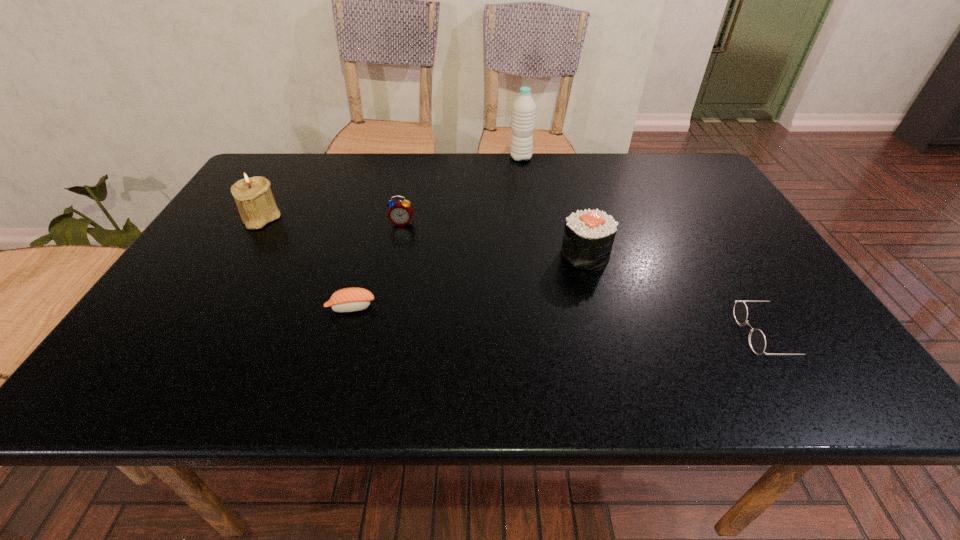
The width and height of the screenshot is (960, 540). What are the coordinates of `the fourth object from left to right` in the screenshot? It's located at (524, 108).

I want to click on the farthest object, so click(x=524, y=108).

The image size is (960, 540). In order to click on the leftmost object in this screenshot , I will do `click(253, 196)`.

Identify the location of the second tallest object. Image resolution: width=960 pixels, height=540 pixels. (253, 196).

Find the location of a particular element. the right sushi is located at coordinates (588, 238).

Locate an element on the screen. the farther sushi is located at coordinates [588, 238].

Find the location of a particular element. This screenshot has height=540, width=960. the fourth tallest object is located at coordinates 400,212.

The width and height of the screenshot is (960, 540). I want to click on spectacles, so click(757, 341).

Where is `the left sushi`? the left sushi is located at coordinates (353, 299).

Where is `the nearer sushi`? The width and height of the screenshot is (960, 540). the nearer sushi is located at coordinates (353, 299).